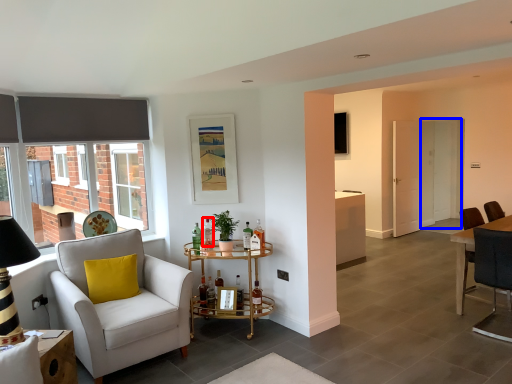
Question: Which of the following is the closest to the observer, bottle (highlighted by a red box) or screen door (highlighted by a blue box)?

Choices:
 (A) bottle
 (B) screen door

Answer: (A)